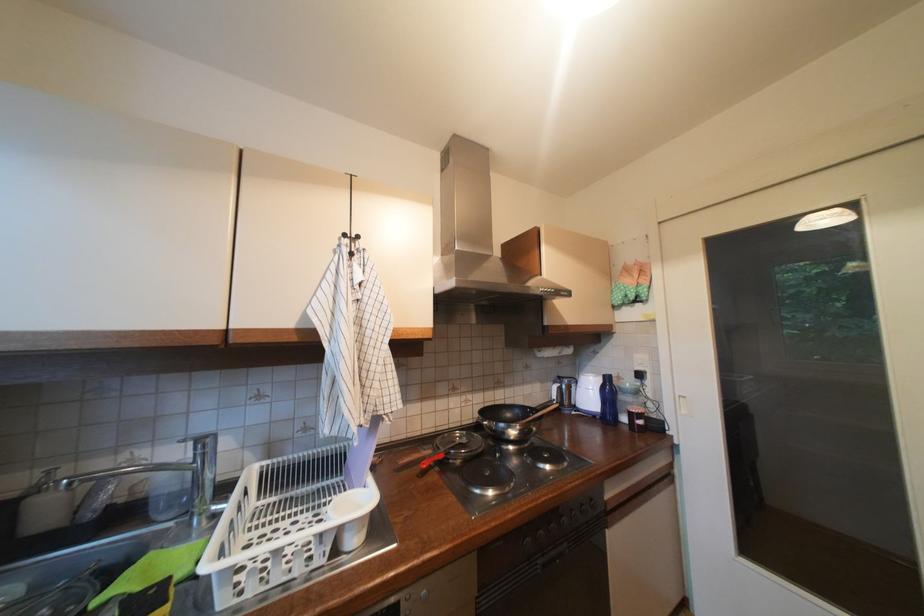
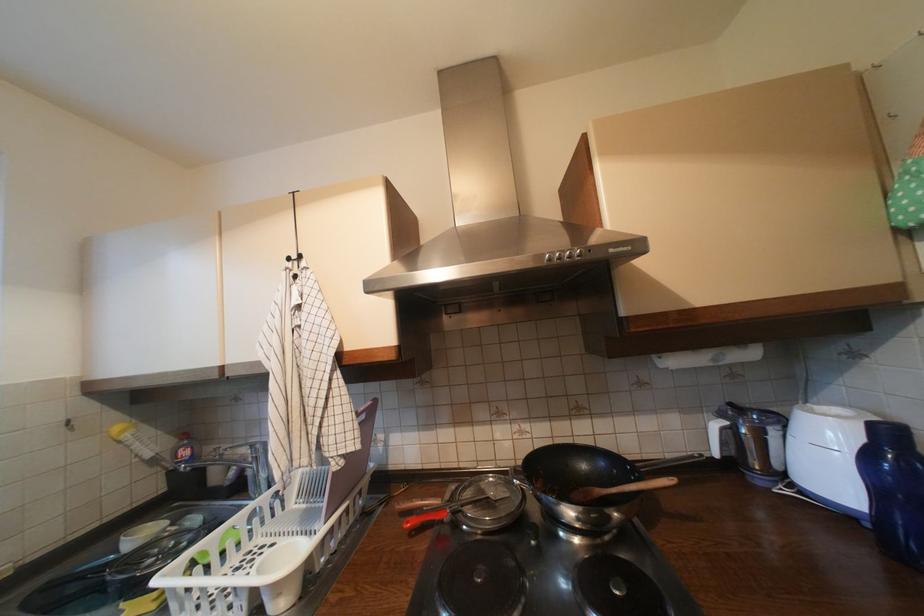
Where in the second image is the point corresponding to pixel 579 389 from the first image?

(774, 435)